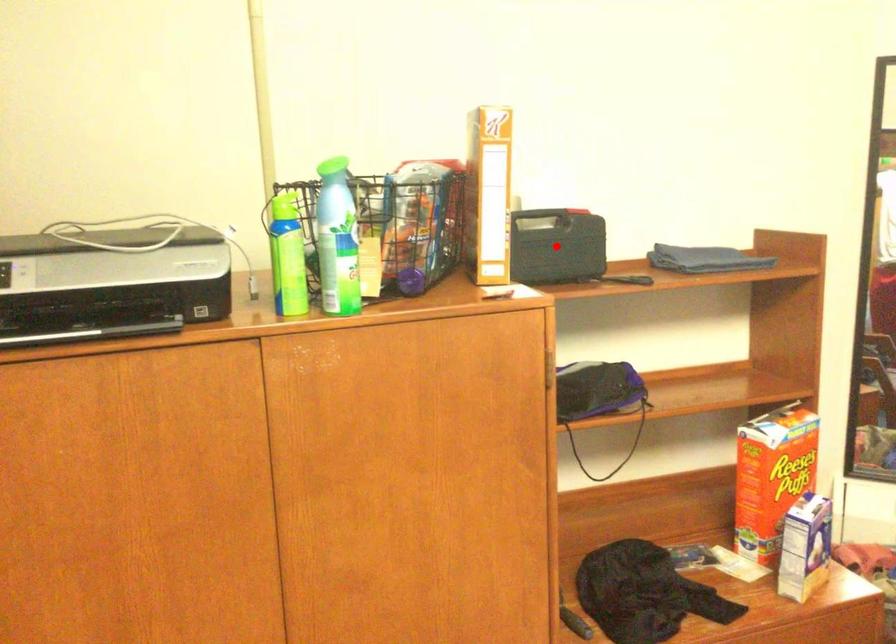
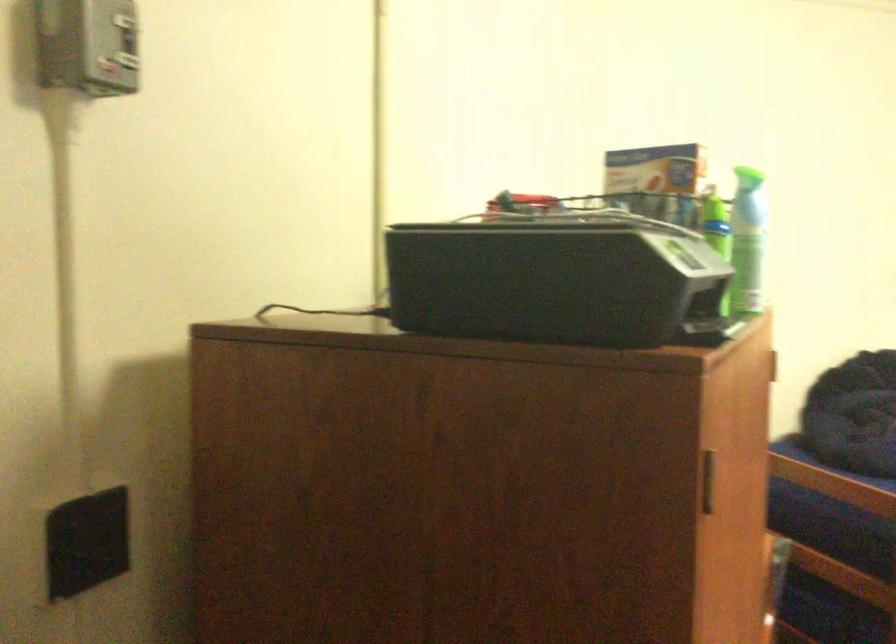
Question: I am providing you with two images of the same scene from different viewpoints. A red point is marked on the first image. At the location where the point appears in image 1, is it still visible in image 2?

Choices:
 (A) Yes
 (B) No

Answer: (B)